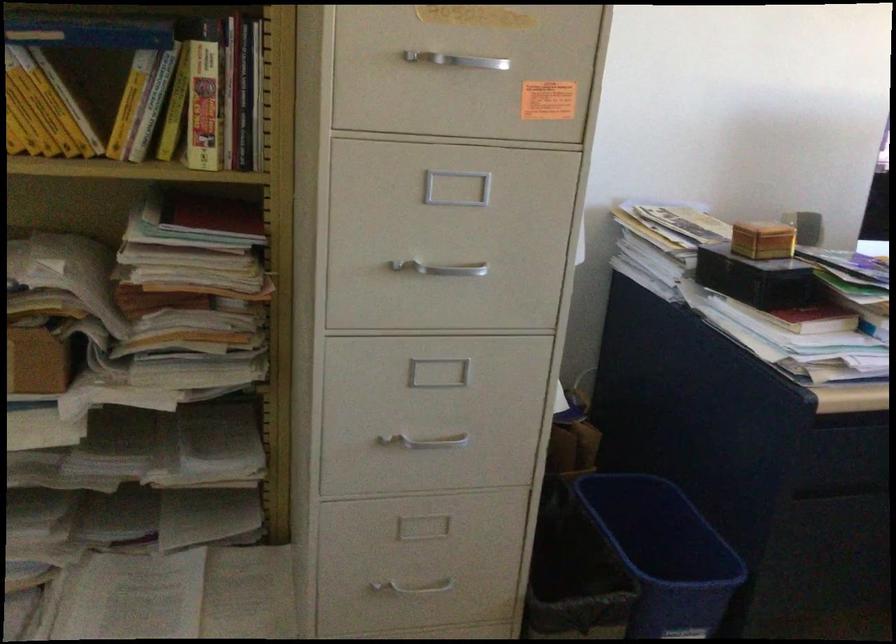
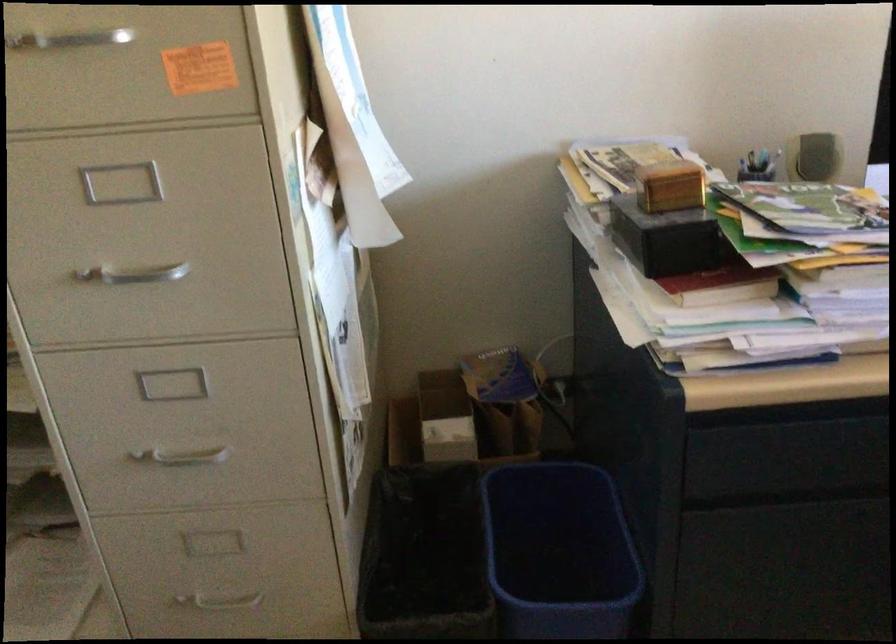
Find the pixel in the second image that matches (451,67) in the first image.

(67, 40)